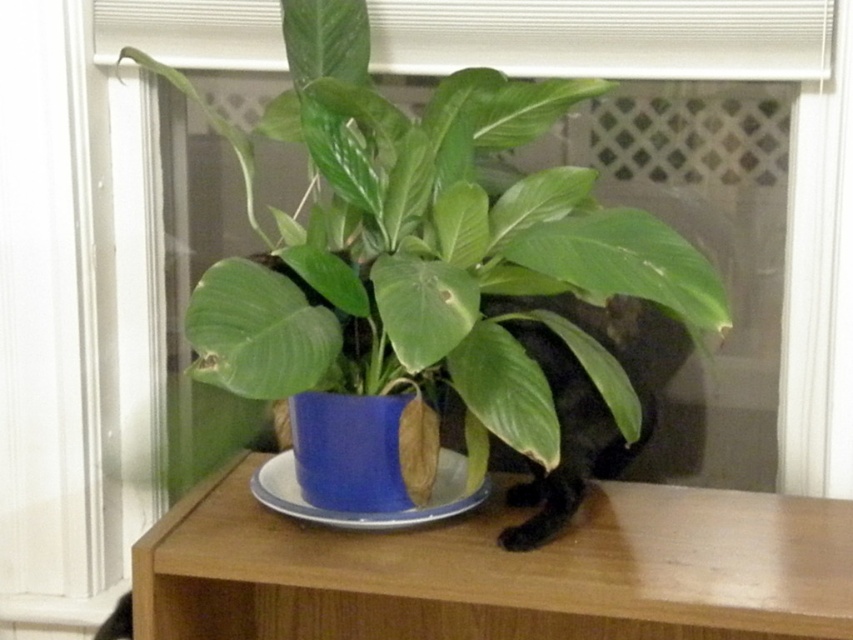
You are a houseplant enthusiast who wants to ensure proper drainage for the blue glossy pot at center. Since the blue ceramic plate at center is beneath it, does the current setup allow water to drain freely into the plate?

The blue glossy pot at center is located above the blue ceramic plate at center, so yes, water can drain freely from the pot into the plate below.

You are standing in front of the potted plant and want to place a small decoration on the wooden surface. You have two options for placement based on coordinates given as points. Which point, point (537, 344) or point (486, 492), is closer to you and thus safer for placing the decoration?

Point (537, 344) is closer to the viewer than point (486, 492), so placing the decoration there would be safer as it is nearer to your position.

You have a small decorative item that is 10 cm in diameter. You want to place it on the wooden shelf at center next to the blue ceramic plate at center. Considering the size of the shelf and plate, will there be enough space for both items?

The wooden shelf at center is larger in size than the blue ceramic plate at center, so there should be enough space to place both items next to each other.